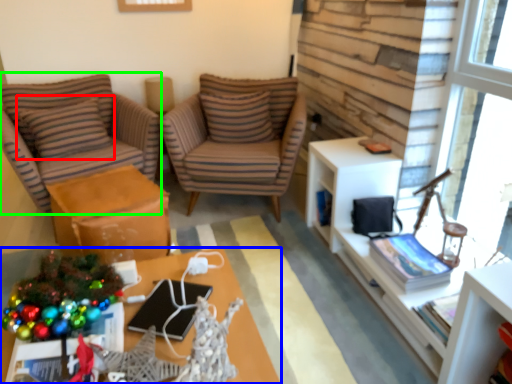
Question: Which object is positioned farthest from pillow (highlighted by a red box)? Select from desk (highlighted by a blue box) and chair (highlighted by a green box).

Choices:
 (A) desk
 (B) chair

Answer: (A)